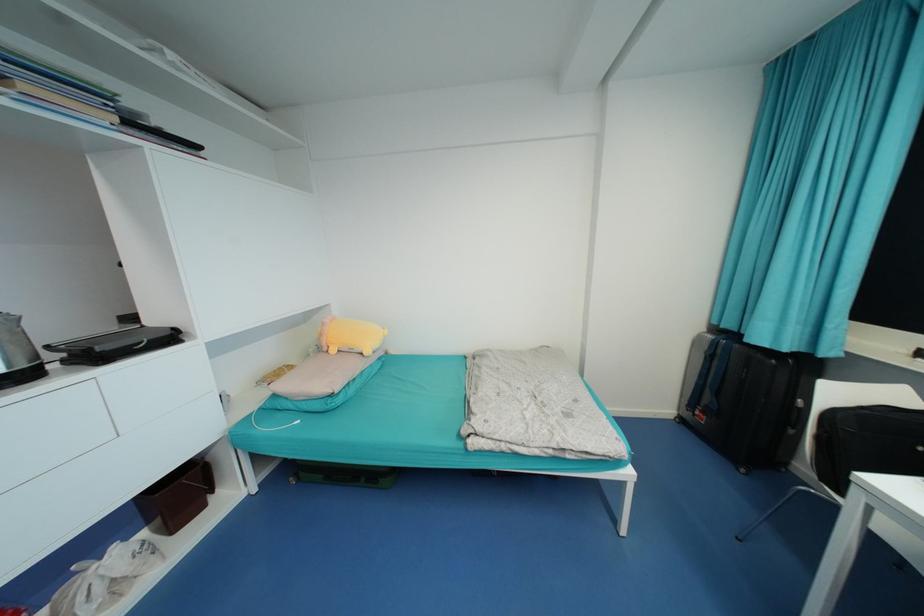
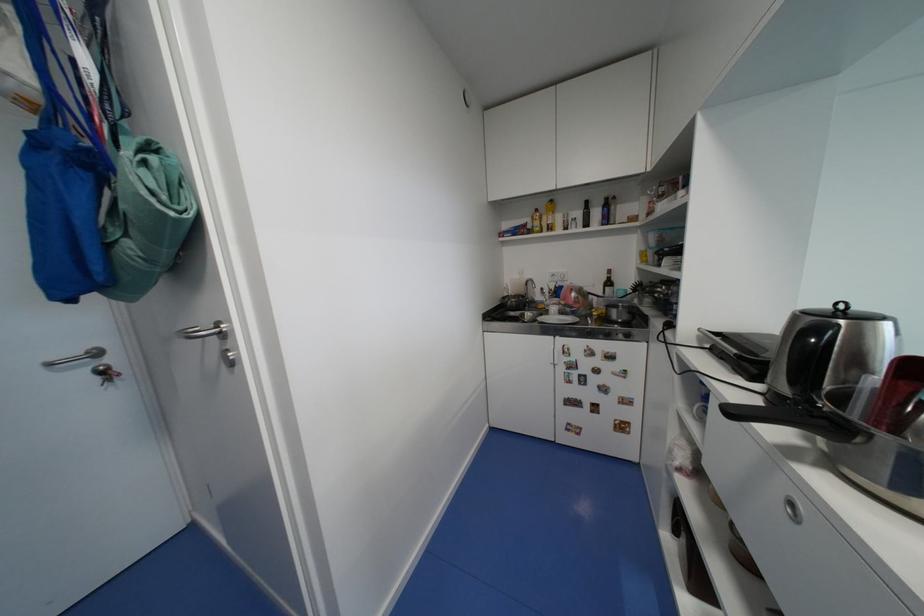
Question: What movement of the cameraman would produce the second image?

Choices:
 (A) Left
 (B) Right
 (C) Forward
 (D) Backward

Answer: (A)